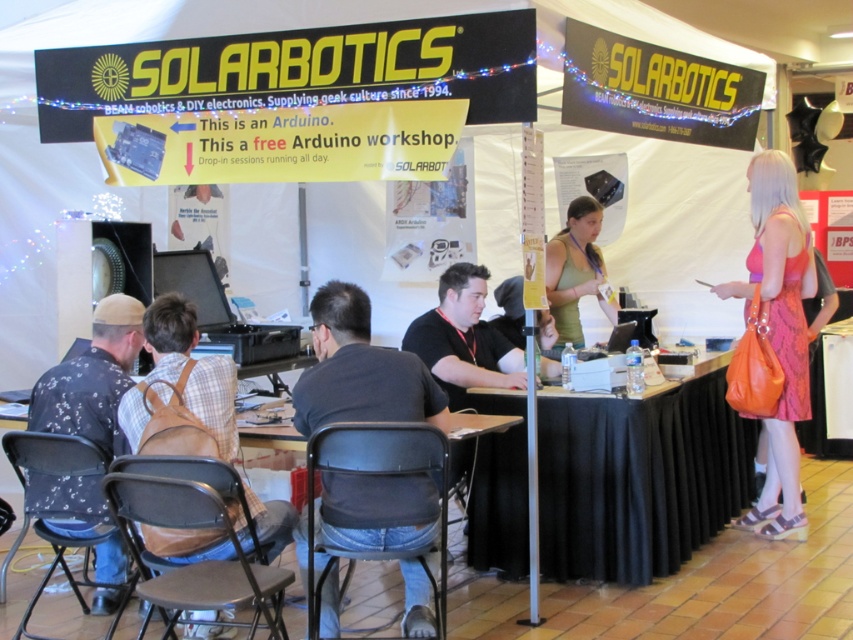
Is metallic black chair at lower left smaller than green matte shirt at upper center?

Actually, metallic black chair at lower left might be larger than green matte shirt at upper center.

Between metallic black chair at lower left and green matte shirt at upper center, which one appears on the left side from the viewer's perspective?

From the viewer's perspective, metallic black chair at lower left appears more on the left side.

Where is `metallic black chair at lower left`? metallic black chair at lower left is located at coordinates (53, 454).

Between brown leather backpack at lower left and black fabric shirt at center, which one is positioned lower?

brown leather backpack at lower left

Describe the element at coordinates (180, 388) in the screenshot. I see `brown leather backpack at lower left` at that location.

Does point (165, 364) lie in front of point (483, 269)?

Yes, point (165, 364) is in front of point (483, 269).

Where is `brown leather backpack at lower left`? The height and width of the screenshot is (640, 853). brown leather backpack at lower left is located at coordinates (180, 388).

Is brown leather backpack at lower left further to camera compared to black plastic chair at center?

No, it is in front of black plastic chair at center.

Can you confirm if brown leather backpack at lower left is wider than black plastic chair at center?

Correct, the width of brown leather backpack at lower left exceeds that of black plastic chair at center.

Between point (213, 611) and point (310, 620), which one is positioned behind?

Positioned behind is point (310, 620).

You are a GUI agent. You are given a task and a screenshot of the screen. Output one action in this format:
    pyautogui.click(x=<x>, y=<y>)
    Task: Click on the brown leather backpack at lower left
    
    Given the screenshot: What is the action you would take?
    pyautogui.click(x=180, y=388)